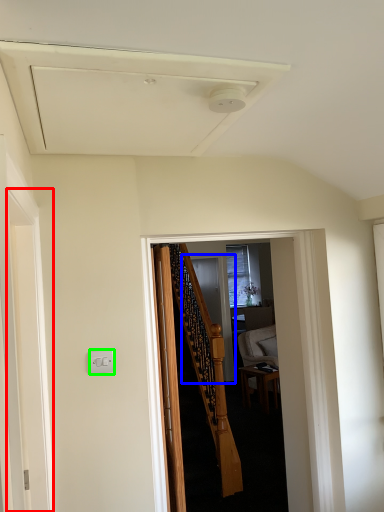
Question: Which object is the farthest from screen door (highlighted by a red box)? Choose among these: screen door (highlighted by a blue box) or electric outlet (highlighted by a green box).

Choices:
 (A) screen door
 (B) electric outlet

Answer: (A)